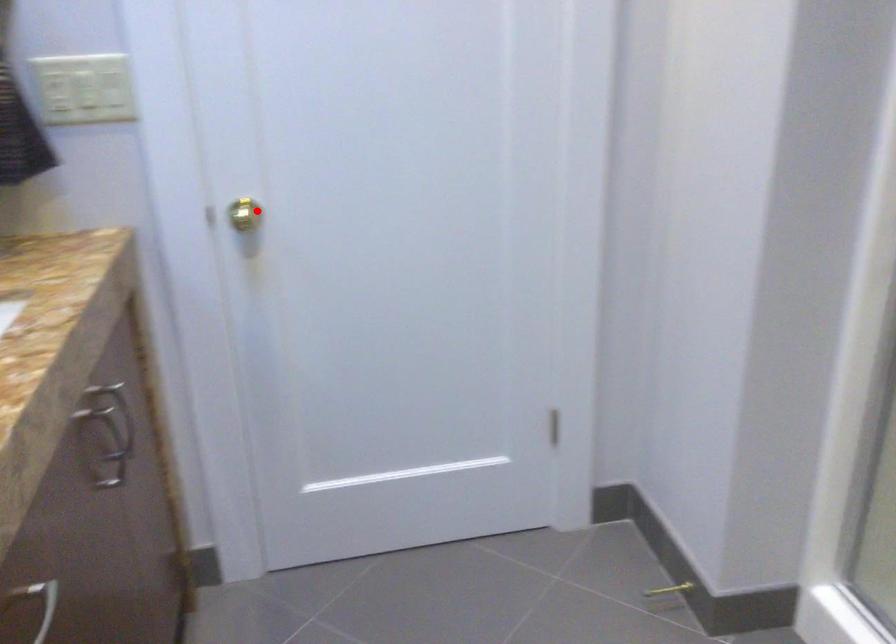
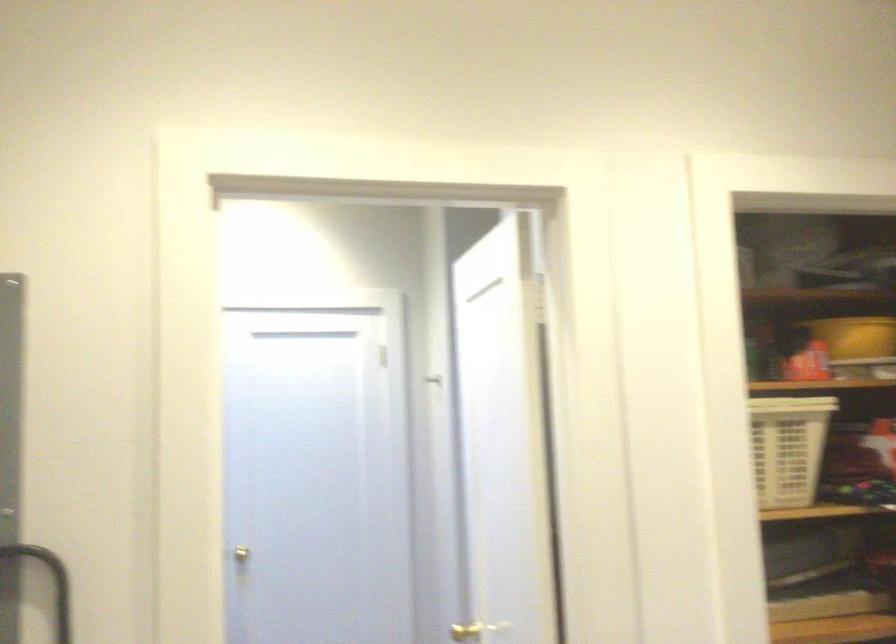
Question: I am providing you with two images of the same scene from different viewpoints. Image1 has a red point marked. In image2, the corresponding 3D location appears at what relative position? Reply with the corresponding letter.

Choices:
 (A) Closer
 (B) Farther

Answer: (B)